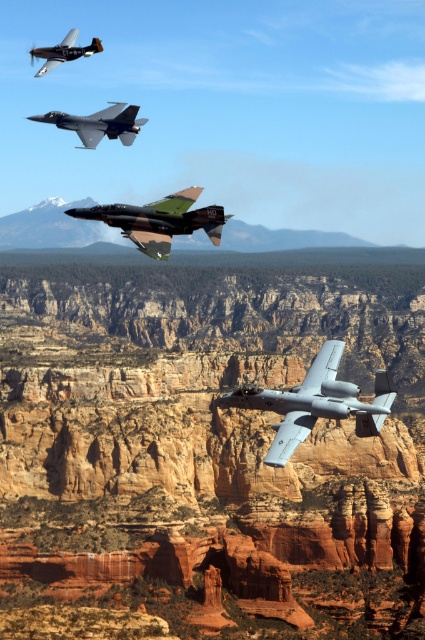
Looking at this image, you are a pilot observing the aerial formation. Which aircraft, the silver metallic jet at center or the camouflage paint fighter jet at center, has a shorter height?

The silver metallic jet at center is not as tall as the camouflage paint fighter jet at center, so the silver metallic jet at center is shorter in height.

In the scene shown: You are a pilot flying a new aircraft and need to position it between the camouflage paint fighter jet at upper center and the brushed metal airplane at upper left. Based on their current positions, which direction should you turn to align with the space between them?

The camouflage paint fighter jet at upper center is to the right of the brushed metal airplane at upper left, so you should turn left to position your aircraft between them.